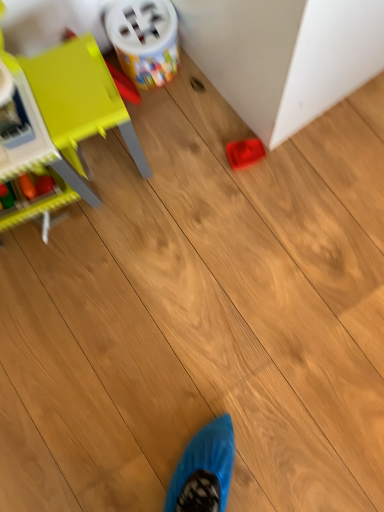
Question: From a real-world perspective, is matte yellow chair at left, which is the 3th toy in right-to-left order, below plastic container at upper center, arranged as the second toy when viewed from the right?

Choices:
 (A) no
 (B) yes

Answer: (A)

Question: Is matte yellow chair at left, the 1th toy in the left-to-right sequence, far away from plastic container at upper center, arranged as the second toy when viewed from the right?

Choices:
 (A) no
 (B) yes

Answer: (A)

Question: Can we say matte yellow chair at left, which is the 3th toy in right-to-left order, lies outside plastic container at upper center, acting as the second toy starting from the left?

Choices:
 (A) yes
 (B) no

Answer: (A)

Question: Is matte yellow chair at left, which is the 3th toy in right-to-left order, shorter than plastic container at upper center, arranged as the second toy when viewed from the right?

Choices:
 (A) yes
 (B) no

Answer: (B)

Question: Does matte yellow chair at left, which is the 3th toy in right-to-left order, appear on the right side of plastic container at upper center, acting as the second toy starting from the left?

Choices:
 (A) no
 (B) yes

Answer: (A)

Question: From the image's perspective, is matte yellow chair at left, which is the 3th toy in right-to-left order, on plastic container at upper center, acting as the second toy starting from the left?

Choices:
 (A) no
 (B) yes

Answer: (A)

Question: From a real-world perspective, is rubberized red tray at lower right over matte yellow chair at left, which is the 3th toy in right-to-left order?

Choices:
 (A) no
 (B) yes

Answer: (A)

Question: Is rubberized red tray at lower right oriented away from matte yellow chair at left, the 1th toy in the left-to-right sequence?

Choices:
 (A) no
 (B) yes

Answer: (B)

Question: Can you see rubberized red tray at lower right touching matte yellow chair at left, the 1th toy in the left-to-right sequence?

Choices:
 (A) no
 (B) yes

Answer: (A)

Question: Can you confirm if rubberized red tray at lower right is positioned to the left of matte yellow chair at left, the 1th toy in the left-to-right sequence?

Choices:
 (A) yes
 (B) no

Answer: (B)

Question: Considering the relative sizes of rubberized red tray at lower right and matte yellow chair at left, the 1th toy in the left-to-right sequence, in the image provided, is rubberized red tray at lower right bigger than matte yellow chair at left, the 1th toy in the left-to-right sequence,?

Choices:
 (A) yes
 (B) no

Answer: (A)

Question: Considering the relative positions of rubberized red tray at lower right and matte yellow chair at left, the 1th toy in the left-to-right sequence, in the image provided, is rubberized red tray at lower right to the right of matte yellow chair at left, the 1th toy in the left-to-right sequence, from the viewer's perspective?

Choices:
 (A) no
 (B) yes

Answer: (B)

Question: Is plastic container at upper center, arranged as the second toy when viewed from the right, behind rubberized red tray at lower right?

Choices:
 (A) no
 (B) yes

Answer: (B)